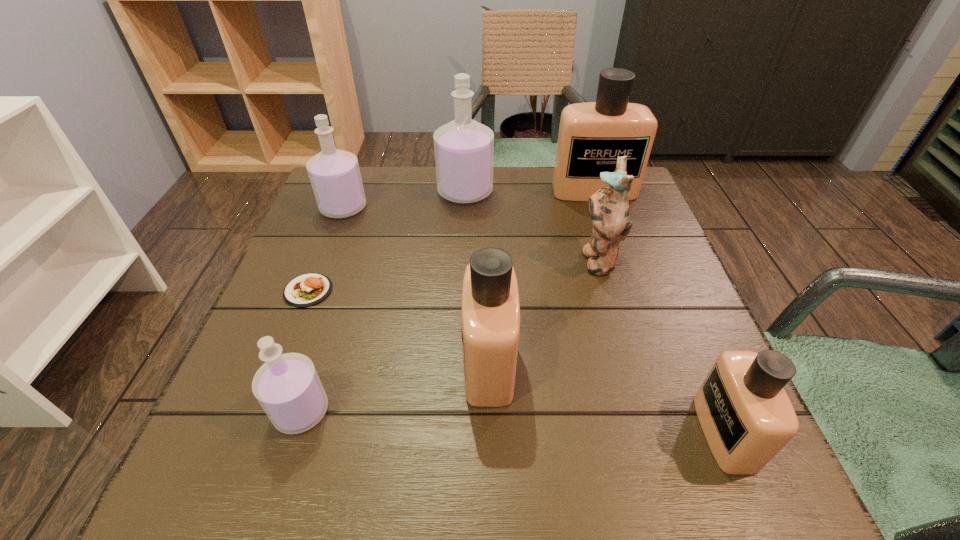
The image size is (960, 540). What are the coordinates of `the closest beige perfume to the leftmost beige perfume` in the screenshot? It's located at (747, 417).

Select which beige perfume is the closest to the biggest purple perfume. Please provide its 2D coordinates. Your answer should be formatted as a tuple, i.e. [(x, y)], where the tuple contains the x and y coordinates of a point satisfying the conditions above.

[(592, 135)]

Locate an element on the screen. The width and height of the screenshot is (960, 540). free spot that satisfies the following two spatial constraints: 1. on the front side of the second biggest purple perfume; 2. on the left side of the nearest purple perfume is located at coordinates (266, 411).

This screenshot has height=540, width=960. In order to click on vacant region that satisfies the following two spatial constraints: 1. on the front side of the patty (food); 2. on the right side of the smallest purple perfume in this screenshot , I will do `click(261, 411)`.

You are a GUI agent. You are given a task and a screenshot of the screen. Output one action in this format:
    pyautogui.click(x=<x>, y=<y>)
    Task: Click on the free space in the image that satisfies the following two spatial constraints: 1. on the front label of the farthest beige perfume; 2. on the front-facing side of the figurine
    
    Given the screenshot: What is the action you would take?
    pyautogui.click(x=617, y=259)

Find the location of a particular element. free space in the image that satisfies the following two spatial constraints: 1. on the back side of the patty (food); 2. on the left side of the second biggest purple perfume is located at coordinates (341, 208).

This screenshot has height=540, width=960. Identify the location of blank space that satisfies the following two spatial constraints: 1. on the front label of the farthest beige perfume; 2. on the front label of the second smallest beige perfume. (652, 363).

Image resolution: width=960 pixels, height=540 pixels. Identify the location of vacant point that satisfies the following two spatial constraints: 1. on the back side of the second smallest purple perfume; 2. on the right side of the biggest purple perfume. (349, 192).